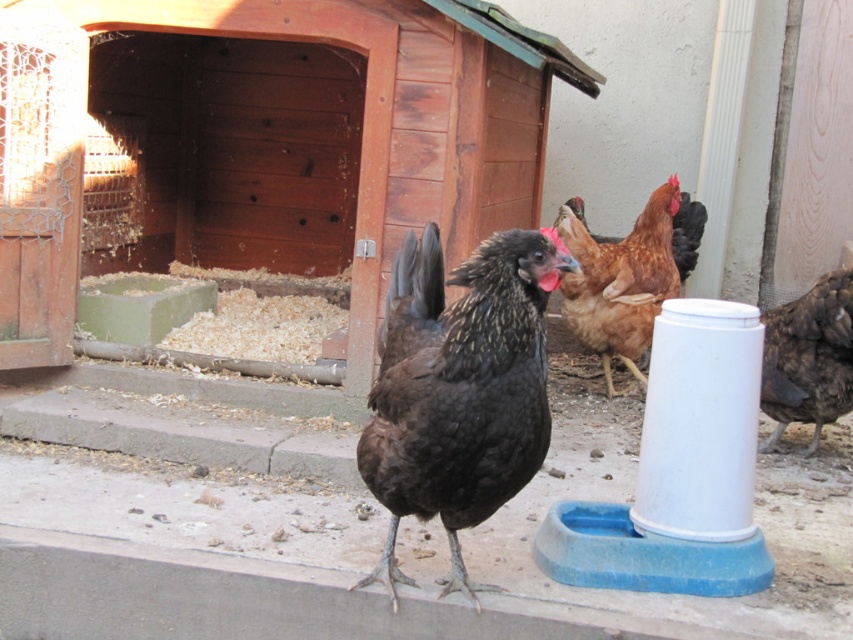
Does point (672, 291) lie in front of point (799, 352)?

No, it is behind (799, 352).

Who is shorter, brown feathered chicken at center or dark brown feathers at right?

With less height is dark brown feathers at right.

At what (x,y) coordinates should I click in order to perform the action: click on brown feathered chicken at center. Please return your answer as a coordinate pair (x, y). Looking at the image, I should click on (621, 282).

Describe the element at coordinates (461, 392) in the screenshot. Image resolution: width=853 pixels, height=640 pixels. I see `shiny black chicken at center` at that location.

Is shiny black chicken at center below shiny black feathers at center?

Indeed, shiny black chicken at center is positioned under shiny black feathers at center.

Does point (486, 508) lie behind point (434, 248)?

No, it is not.

The height and width of the screenshot is (640, 853). Find the location of `shiny black chicken at center`. shiny black chicken at center is located at coordinates click(x=461, y=392).

Based on the photo, does wooden coop at center have a larger size compared to shiny black feathers at center?

Indeed, wooden coop at center has a larger size compared to shiny black feathers at center.

Is wooden coop at center to the right of shiny black feathers at center from the viewer's perspective?

Incorrect, wooden coop at center is not on the right side of shiny black feathers at center.

Is point (86, 260) closer to camera compared to point (387, 316)?

No, (86, 260) is behind (387, 316).

Where is `wooden coop at center`? wooden coop at center is located at coordinates (258, 144).